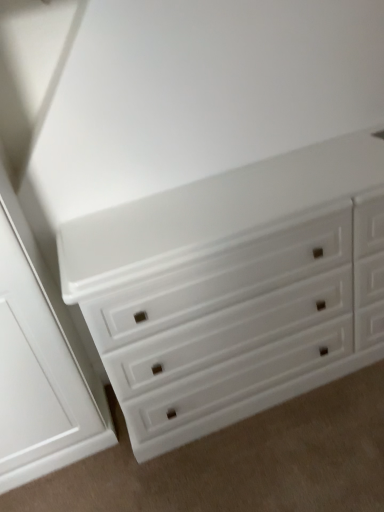
Question: Should I look upward or downward to see white painted wood chest of drawers at center?

Choices:
 (A) up
 (B) down

Answer: (B)